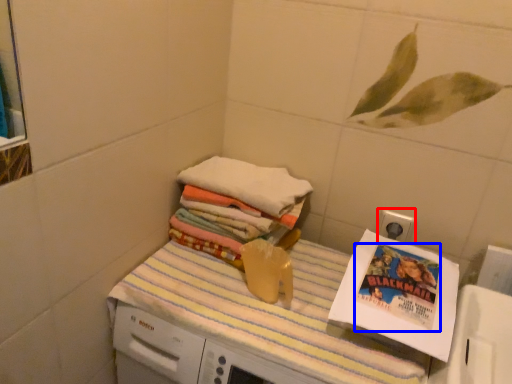
Question: Which object is further to the camera taking this photo, electric outlet (highlighted by a red box) or comic book (highlighted by a blue box)?

Choices:
 (A) electric outlet
 (B) comic book

Answer: (A)